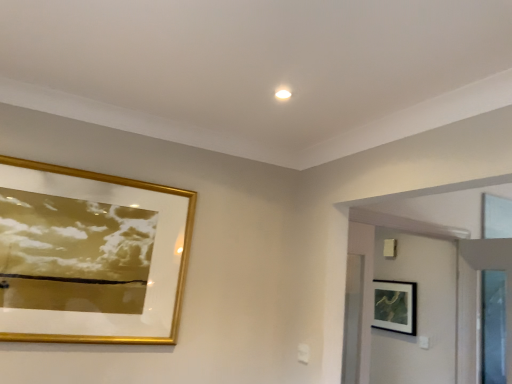
How much space does gold/glass picture frame at upper left, which is counted as the 2th picture frame, starting from the bottom, occupy horizontally?

gold/glass picture frame at upper left, which is counted as the 2th picture frame, starting from the bottom, is 1.96 inches in width.

Find the location of a particular element. The height and width of the screenshot is (384, 512). black matte picture frame at upper right, which ranks as the 2th picture frame in front-to-back order is located at coordinates (395, 306).

Is black matte picture frame at upper right, the 2th picture frame in the top-to-bottom sequence, facing away from gold/glass picture frame at upper left, positioned as the first picture frame in left-to-right order?

That's not correct — black matte picture frame at upper right, the 2th picture frame in the top-to-bottom sequence, is not looking away from gold/glass picture frame at upper left, positioned as the first picture frame in left-to-right order.

Is black matte picture frame at upper right, which appears as the 1th picture frame when viewed from the right, shorter than gold/glass picture frame at upper left, which appears as the 1th picture frame when viewed from the top?

Indeed, black matte picture frame at upper right, which appears as the 1th picture frame when viewed from the right, has a lesser height compared to gold/glass picture frame at upper left, which appears as the 1th picture frame when viewed from the top.

From the picture: Considering the sizes of objects black matte picture frame at upper right, which appears as the 1th picture frame when viewed from the right, and gold/glass picture frame at upper left, positioned as the first picture frame in left-to-right order, in the image provided, who is thinner, black matte picture frame at upper right, which appears as the 1th picture frame when viewed from the right, or gold/glass picture frame at upper left, positioned as the first picture frame in left-to-right order,?

gold/glass picture frame at upper left, positioned as the first picture frame in left-to-right order, is thinner.

Measure the distance from black matte picture frame at upper right, the 2th picture frame in the top-to-bottom sequence, to gold/glass picture frame at upper left, acting as the 1th picture frame starting from the front.

black matte picture frame at upper right, the 2th picture frame in the top-to-bottom sequence, and gold/glass picture frame at upper left, acting as the 1th picture frame starting from the front, are 8.16 feet apart from each other.

Does point (419, 374) appear closer or farther from the camera than point (89, 224)?

Clearly, point (419, 374) is more distant from the camera than point (89, 224).

Is white glossy door at upper right facing away from gold/glass picture frame at upper left, which appears as the 1th picture frame when viewed from the top?

white glossy door at upper right does not have its back to gold/glass picture frame at upper left, which appears as the 1th picture frame when viewed from the top.

Is white glossy door at upper right spatially inside gold/glass picture frame at upper left, which appears as the 1th picture frame when viewed from the top, or outside of it?

white glossy door at upper right exists outside the volume of gold/glass picture frame at upper left, which appears as the 1th picture frame when viewed from the top.

Where is `picture frame behind the gold/glass picture frame at upper left, positioned as the first picture frame in left-to-right order`? The image size is (512, 384). picture frame behind the gold/glass picture frame at upper left, positioned as the first picture frame in left-to-right order is located at coordinates (395, 306).

In terms of width, does gold/glass picture frame at upper left, marked as the 2th picture frame in a back-to-front arrangement, look wider or thinner when compared to black matte picture frame at upper right, the first picture frame ordered from the bottom?

Clearly, gold/glass picture frame at upper left, marked as the 2th picture frame in a back-to-front arrangement, has less width compared to black matte picture frame at upper right, the first picture frame ordered from the bottom.

Is gold/glass picture frame at upper left, positioned as the first picture frame in left-to-right order, positioned with its back to black matte picture frame at upper right, which appears as the 1th picture frame when viewed from the right?

No, gold/glass picture frame at upper left, positioned as the first picture frame in left-to-right order,'s orientation is not away from black matte picture frame at upper right, which appears as the 1th picture frame when viewed from the right.

From the image's perspective, between gold/glass picture frame at upper left, positioned as the first picture frame in left-to-right order, and black matte picture frame at upper right, which ranks as the 2th picture frame in front-to-back order, which one is located above?

From the image's view, gold/glass picture frame at upper left, positioned as the first picture frame in left-to-right order, is above.

Is gold/glass picture frame at upper left, marked as the 2th picture frame in a back-to-front arrangement, bigger than white glossy door at upper right?

No.

Consider the image. Do you think gold/glass picture frame at upper left, which is counted as the 2th picture frame, starting from the bottom, is within white glossy door at upper right, or outside of it?

The correct answer is: outside.

Between point (121, 256) and point (408, 273), which one is positioned behind?

Point (408, 273)

Is gold/glass picture frame at upper left, acting as the 1th picture frame starting from the front, in front of or behind white glossy door at upper right in the image?

Visually, gold/glass picture frame at upper left, acting as the 1th picture frame starting from the front, is located in front of white glossy door at upper right.

Is black matte picture frame at upper right, which ranks as the second picture frame in left-to-right order, thinner than white glossy door at upper right?

Correct, the width of black matte picture frame at upper right, which ranks as the second picture frame in left-to-right order, is less than that of white glossy door at upper right.

Between black matte picture frame at upper right, which appears as the 1th picture frame when viewed from the right, and white glossy door at upper right, which one has less height?

Standing shorter between the two is black matte picture frame at upper right, which appears as the 1th picture frame when viewed from the right.

Considering the relative positions of black matte picture frame at upper right, the 2th picture frame in the top-to-bottom sequence, and white glossy door at upper right in the image provided, is black matte picture frame at upper right, the 2th picture frame in the top-to-bottom sequence, to the left or to the right of white glossy door at upper right?

Based on their positions, black matte picture frame at upper right, the 2th picture frame in the top-to-bottom sequence, is located to the right of white glossy door at upper right.

Does point (397, 299) lie behind point (423, 287)?

Yes, point (397, 299) is behind point (423, 287).

Considering the positions of objects white glossy door at upper right and black matte picture frame at upper right, the first picture frame ordered from the bottom, in the image provided, who is behind, white glossy door at upper right or black matte picture frame at upper right, the first picture frame ordered from the bottom,?

Positioned behind is black matte picture frame at upper right, the first picture frame ordered from the bottom.

Considering the sizes of white glossy door at upper right and black matte picture frame at upper right, the 2th picture frame in the top-to-bottom sequence, in the image, is white glossy door at upper right wider or thinner than black matte picture frame at upper right, the 2th picture frame in the top-to-bottom sequence,?

white glossy door at upper right is wider than black matte picture frame at upper right, the 2th picture frame in the top-to-bottom sequence.

Can you confirm if white glossy door at upper right is positioned to the right of black matte picture frame at upper right, the 2th picture frame in the top-to-bottom sequence?

No.

Find the location of a particular element. The image size is (512, 384). picture frame behind the gold/glass picture frame at upper left, which appears as the 1th picture frame when viewed from the top is located at coordinates (395, 306).

Where is `picture frame above the white glossy door at upper right (from a real-world perspective)`? The width and height of the screenshot is (512, 384). picture frame above the white glossy door at upper right (from a real-world perspective) is located at coordinates (90, 255).

Estimate the real-world distances between objects in this image. Which object is further from white glossy door at upper right, black matte picture frame at upper right, the 2th picture frame in the top-to-bottom sequence, or gold/glass picture frame at upper left, marked as the 2th picture frame in a back-to-front arrangement?

gold/glass picture frame at upper left, marked as the 2th picture frame in a back-to-front arrangement, is further to white glossy door at upper right.

Which object lies nearer to the anchor point white glossy door at upper right, gold/glass picture frame at upper left, which is counted as the 2th picture frame, starting from the bottom, or black matte picture frame at upper right, which ranks as the second picture frame in left-to-right order?

black matte picture frame at upper right, which ranks as the second picture frame in left-to-right order, lies closer to white glossy door at upper right than the other object.

Estimate the real-world distances between objects in this image. Which object is further from black matte picture frame at upper right, the 2th picture frame in the top-to-bottom sequence, gold/glass picture frame at upper left, which appears as the 1th picture frame when viewed from the top, or white glossy door at upper right?

The object further to black matte picture frame at upper right, the 2th picture frame in the top-to-bottom sequence, is gold/glass picture frame at upper left, which appears as the 1th picture frame when viewed from the top.

Looking at the image, which one is located closer to black matte picture frame at upper right, which ranks as the 2th picture frame in front-to-back order, white glossy door at upper right or gold/glass picture frame at upper left, which is counted as the 2th picture frame, starting from the bottom?

white glossy door at upper right is positioned closer to the anchor black matte picture frame at upper right, which ranks as the 2th picture frame in front-to-back order.

Looking at the image, which one is located further to gold/glass picture frame at upper left, the second picture frame viewed from the right, black matte picture frame at upper right, which appears as the 1th picture frame when viewed from the right, or white glossy door at upper right?

black matte picture frame at upper right, which appears as the 1th picture frame when viewed from the right, lies further to gold/glass picture frame at upper left, the second picture frame viewed from the right, than the other object.

Which object lies nearer to the anchor point gold/glass picture frame at upper left, marked as the 2th picture frame in a back-to-front arrangement, white glossy door at upper right or black matte picture frame at upper right, the 2th picture frame in the top-to-bottom sequence?

Based on the image, white glossy door at upper right appears to be nearer to gold/glass picture frame at upper left, marked as the 2th picture frame in a back-to-front arrangement.

What are the coordinates of `door between gold/glass picture frame at upper left, which appears as the 1th picture frame when viewed from the top, and black matte picture frame at upper right, the first picture frame ordered from the bottom, from left to right` in the screenshot? It's located at (418, 311).